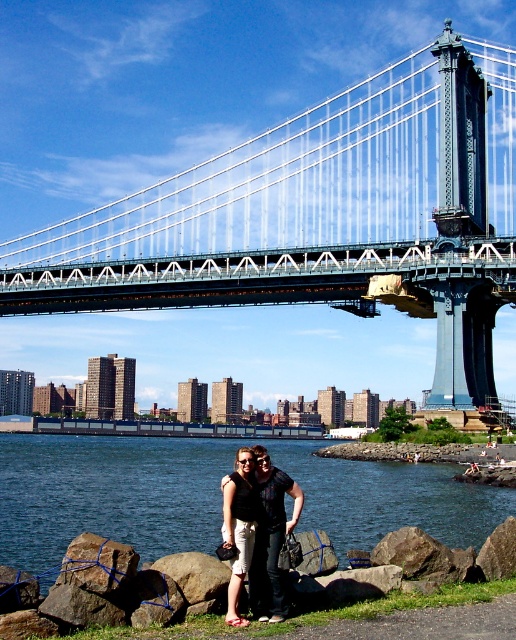
You are a photographer planning to take a picture of the blue water at lower left and the smooth gray rock at lower center. Based on the scene, which object would appear closer to the camera in the photo?

The smooth gray rock at lower center appears closer to the camera because it is positioned behind the blue water at lower left, making the water seem farther away in the image.

You are a photographer trying to capture the suspension bridge in the distance. You notice blue water at lower left and smooth gray rock at lower center in your frame. Based on their positions, which object is closer to the right edge of your photo?

The blue water at lower left is to the right of smooth gray rock at lower center, so the blue water at lower left is closer to the right edge of the photo.